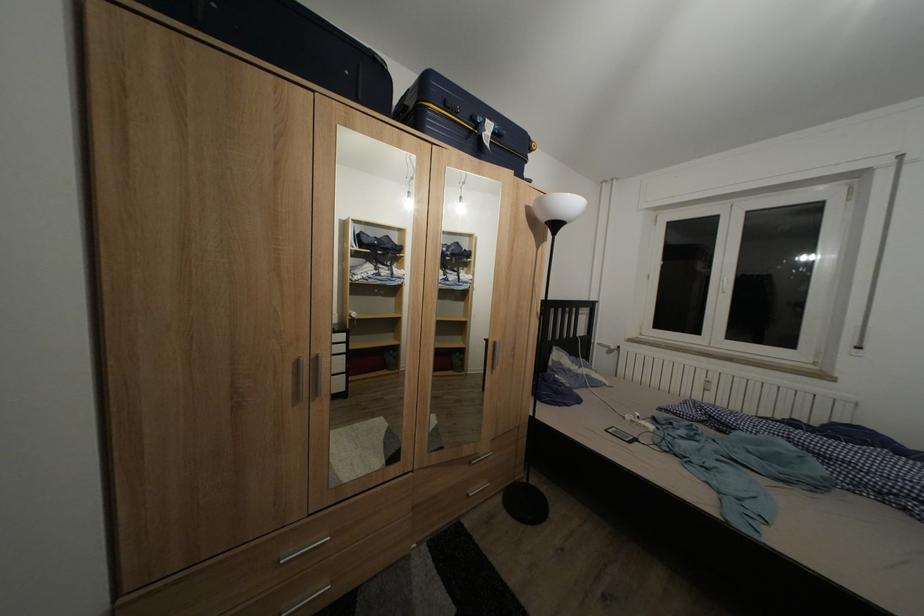
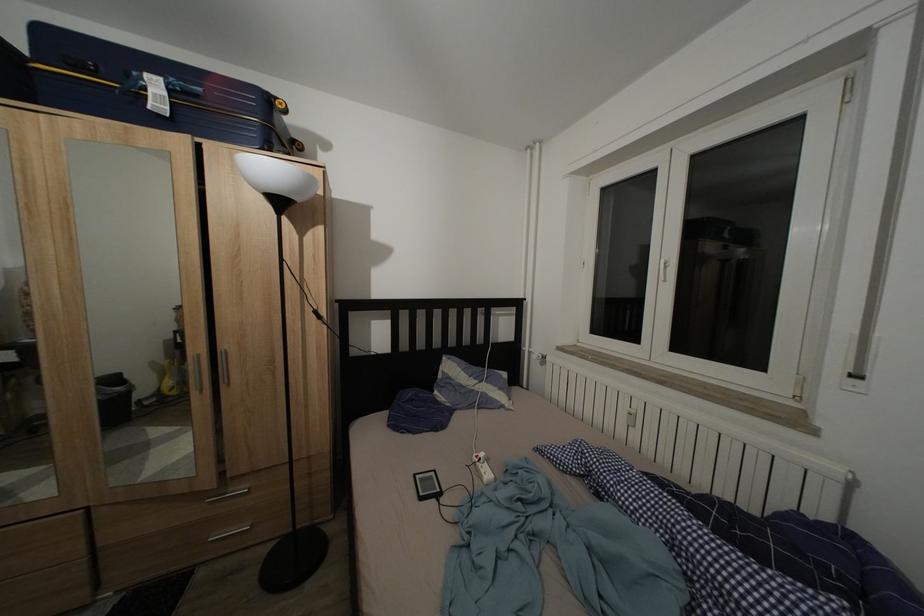
In the second image, find the point that corresponds to [652,434] in the first image.

(488, 483)